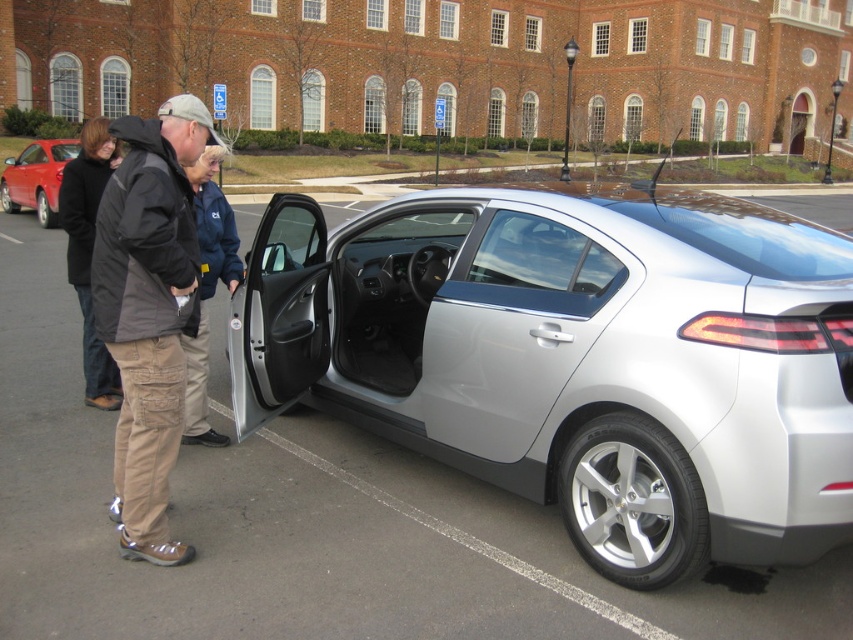
Question: Estimate the real-world distances between objects in this image. Which object is closer to the matte red sedan at left?

Choices:
 (A) dark blue jacket at center
 (B) silver metallic car at center
 (C) black wool coat at left

Answer: (C)

Question: Which object is the farthest from the khaki cargo pants at left?

Choices:
 (A) silver metallic car door at center
 (B) black wool coat at left
 (C) silver metallic car at center

Answer: (C)

Question: Is the position of dark blue jacket at center less distant than that of matte red sedan at left?

Choices:
 (A) no
 (B) yes

Answer: (B)

Question: Which point is farther from the camera taking this photo?

Choices:
 (A) (427, 378)
 (B) (67, 250)
 (C) (178, 433)

Answer: (B)

Question: Can you confirm if silver metallic car at center is positioned above khaki cargo pants at left?

Choices:
 (A) no
 (B) yes

Answer: (A)

Question: In this image, where is silver metallic car door at center located relative to matte red sedan at left?

Choices:
 (A) right
 (B) left

Answer: (A)